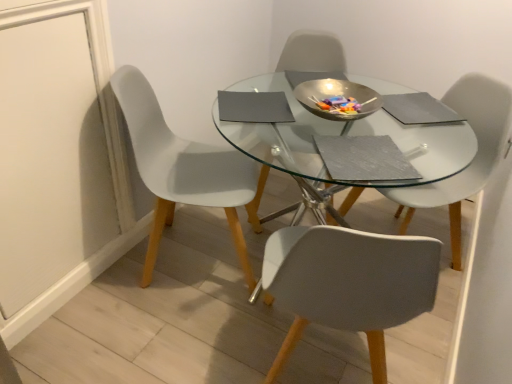
Question: From a real-world perspective, is matte gray chair at center, positioned as the 2th chair in right-to-left order, under white plastic chair at left, the third chair positioned from the right?

Choices:
 (A) no
 (B) yes

Answer: (A)

Question: Considering the relative sizes of matte gray chair at center, positioned as the 2th chair in right-to-left order, and white plastic chair at left, the third chair positioned from the right, in the image provided, is matte gray chair at center, positioned as the 2th chair in right-to-left order, shorter than white plastic chair at left, the third chair positioned from the right,?

Choices:
 (A) no
 (B) yes

Answer: (B)

Question: Is white plastic chair at left, which ranks as the 1th chair in left-to-right order, located within matte gray chair at center, positioned as the 2th chair in right-to-left order?

Choices:
 (A) yes
 (B) no

Answer: (B)

Question: Is the surface of matte gray chair at center, positioned as the 2th chair in right-to-left order, in direct contact with white plastic chair at left, the third chair positioned from the right?

Choices:
 (A) no
 (B) yes

Answer: (A)

Question: From a real-world perspective, is matte gray chair at center, positioned as the 2th chair in right-to-left order, over white plastic chair at left, the third chair positioned from the right?

Choices:
 (A) yes
 (B) no

Answer: (A)

Question: From a real-world perspective, relative to white plastic chair at left, which ranks as the 1th chair in left-to-right order, is transparent glass table at center vertically above or below?

Choices:
 (A) below
 (B) above

Answer: (A)

Question: From the image's perspective, relative to white plastic chair at left, which ranks as the 1th chair in left-to-right order, is transparent glass table at center above or below?

Choices:
 (A) above
 (B) below

Answer: (B)

Question: Is transparent glass table at center bigger or smaller than white plastic chair at left, which ranks as the 1th chair in left-to-right order?

Choices:
 (A) big
 (B) small

Answer: (A)

Question: Is point (266, 160) closer or farther from the camera than point (136, 127)?

Choices:
 (A) closer
 (B) farther

Answer: (B)

Question: Visually, is white plastic chair at left, the third chair positioned from the right, positioned to the left or to the right of transparent glass table at center?

Choices:
 (A) left
 (B) right

Answer: (A)

Question: Is white plastic chair at left, which ranks as the 1th chair in left-to-right order, inside or outside of transparent glass table at center?

Choices:
 (A) outside
 (B) inside

Answer: (B)

Question: From the image's perspective, relative to transparent glass table at center, is white plastic chair at left, which ranks as the 1th chair in left-to-right order, above or below?

Choices:
 (A) below
 (B) above

Answer: (B)

Question: From a real-world perspective, is white plastic chair at left, which ranks as the 1th chair in left-to-right order, positioned above or below transparent glass table at center?

Choices:
 (A) above
 (B) below

Answer: (A)

Question: From a real-world perspective, relative to white plastic chair at left, the third chair positioned from the right, is white plastic chair at center, which is counted as the 1th chair, starting from the right, vertically above or below?

Choices:
 (A) above
 (B) below

Answer: (B)

Question: Is white plastic chair at center, the 3th chair when ordered from left to right, in front of or behind white plastic chair at left, which ranks as the 1th chair in left-to-right order, in the image?

Choices:
 (A) front
 (B) behind

Answer: (B)